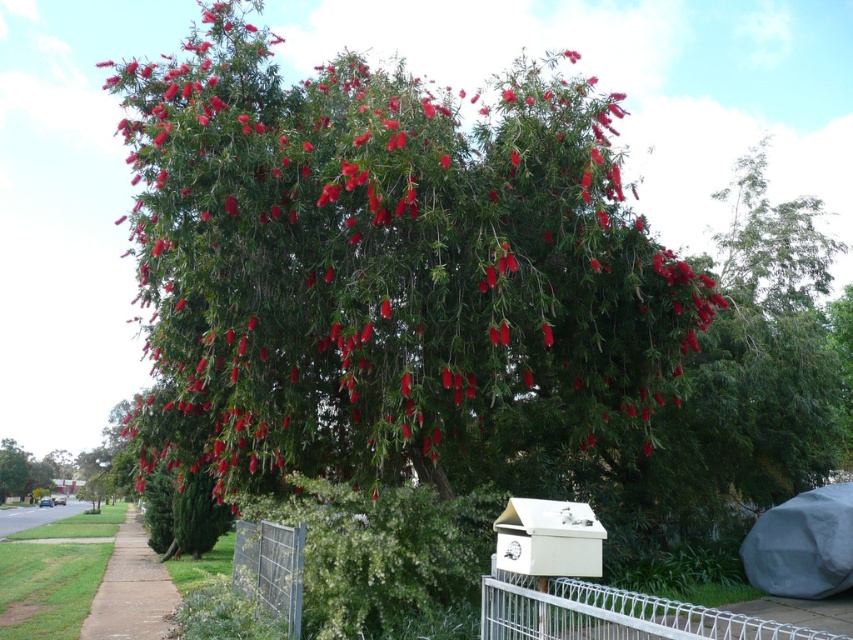
Question: Which point is farther to the camera?

Choices:
 (A) brown asphalt at lower left
 (B) brown concrete sidewalk at lower left
 (C) metallic silver fence at lower center

Answer: (A)

Question: Can you confirm if white wire mesh at lower center is positioned to the left of brown concrete sidewalk at lower left?

Choices:
 (A) no
 (B) yes

Answer: (A)

Question: Does white wire mesh at lower center have a smaller size compared to metallic silver fence at lower center?

Choices:
 (A) no
 (B) yes

Answer: (B)

Question: Among these objects, which one is nearest to the camera?

Choices:
 (A) metallic silver fence at lower center
 (B) brown asphalt at lower left
 (C) white wire mesh at lower center
 (D) brown concrete sidewalk at lower left

Answer: (A)

Question: In this image, where is white wire mesh at lower center located relative to metallic silver fence at lower center?

Choices:
 (A) right
 (B) left

Answer: (A)

Question: Which object is closer to the camera taking this photo?

Choices:
 (A) brown asphalt at lower left
 (B) white wire mesh at lower center

Answer: (B)